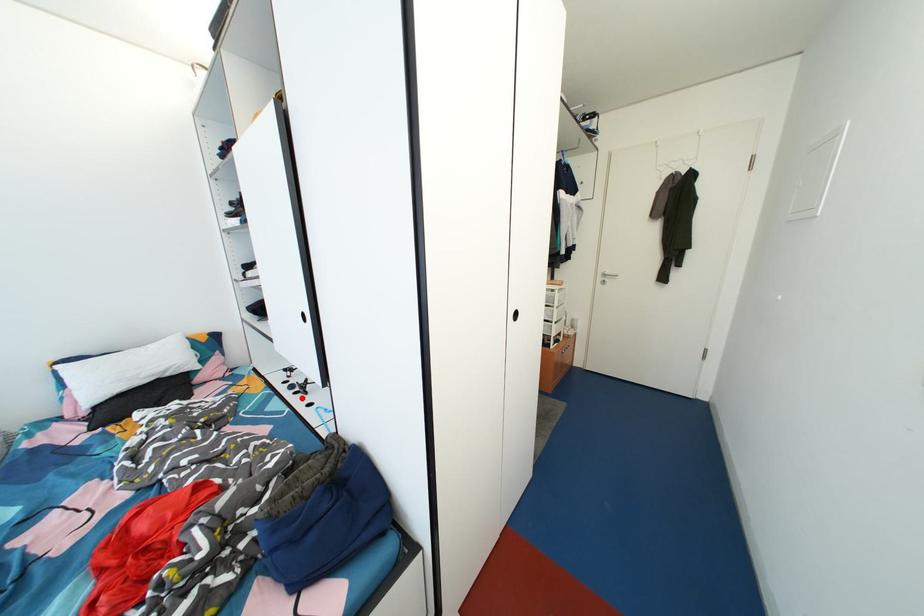
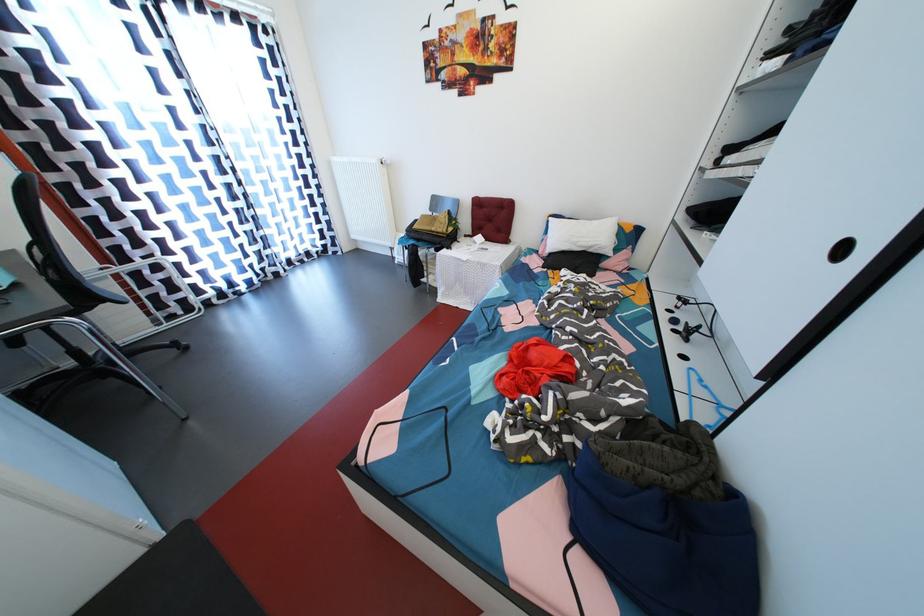
Question: I am providing you with two images of the same scene from different viewpoints. A red point is marked on the first image. At the location where the point appears in image 1, is it still visible in image 2?

Choices:
 (A) Yes
 (B) No

Answer: (A)